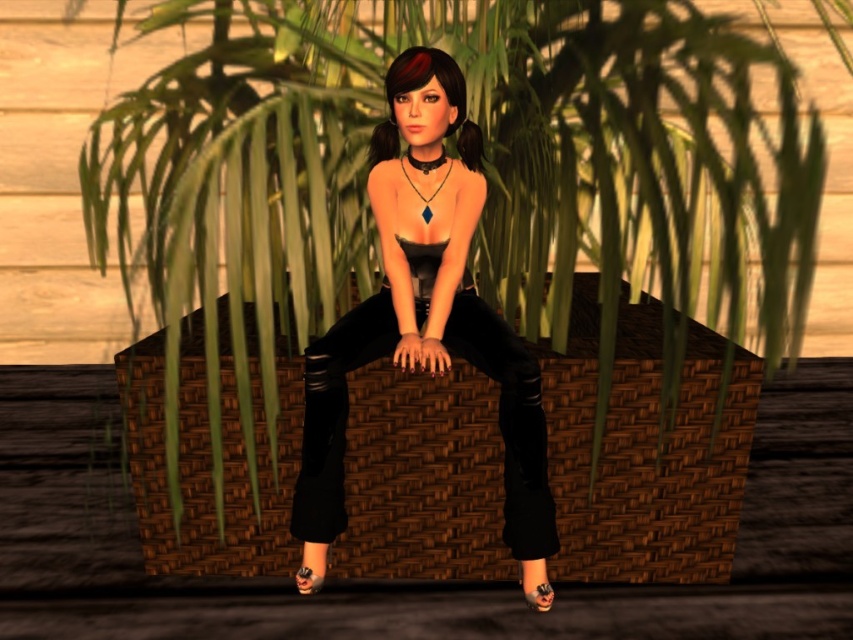
Question: Which point appears farthest from the camera in this image?

Choices:
 (A) (396, 188)
 (B) (523, 579)

Answer: (A)

Question: Which object appears farthest from the camera in this image?

Choices:
 (A) matte black pants at center
 (B) black leather sandal at lower center

Answer: (B)

Question: Can you confirm if matte black pants at center is wider than black leather sandal at lower center?

Choices:
 (A) no
 (B) yes

Answer: (B)

Question: Is matte black pants at center bigger than black leather sandal at lower center?

Choices:
 (A) yes
 (B) no

Answer: (A)

Question: Can you confirm if matte black pants at center is wider than black leather sandal at lower center?

Choices:
 (A) no
 (B) yes

Answer: (B)